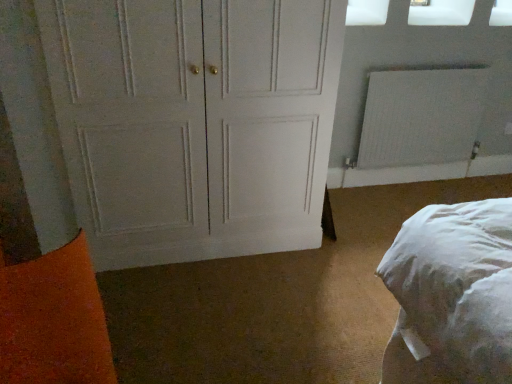
Locate an element on the screen. vacant space in white textured radiator at upper right (from a real-world perspective) is located at coordinates (404, 182).